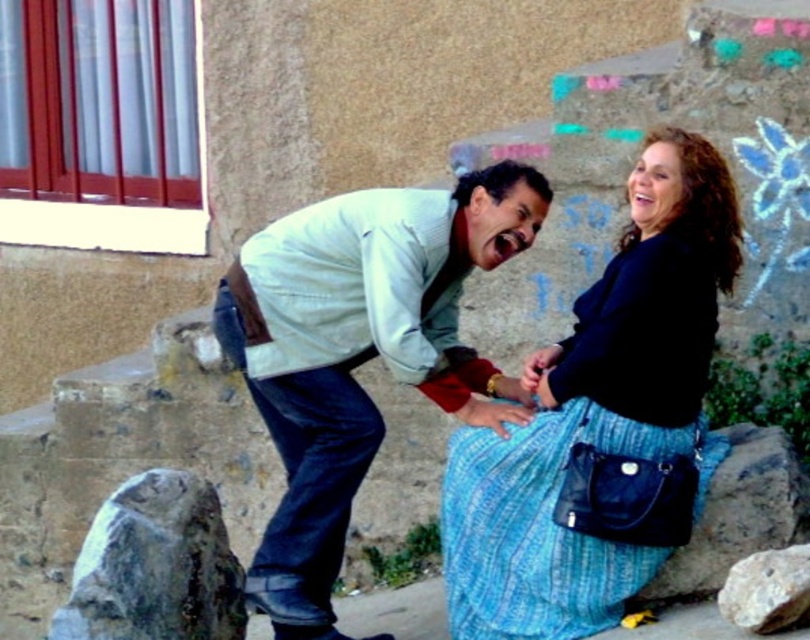
Question: Considering the relative positions of gray rough rock at lower left and smooth gray rock at lower right in the image provided, where is gray rough rock at lower left located with respect to smooth gray rock at lower right?

Choices:
 (A) right
 (B) left

Answer: (B)

Question: Which object appears closest to the camera in this image?

Choices:
 (A) light blue denim jeans at center
 (B) gray rough rock at lower right

Answer: (B)

Question: Is gray rough rock at lower left below gray rough rock at lower right?

Choices:
 (A) yes
 (B) no

Answer: (A)

Question: Which of these objects is positioned closest to the gray rough rock at lower right?

Choices:
 (A) blue textured skirt at center
 (B) gray rough rock at lower left

Answer: (A)

Question: From the image, what is the correct spatial relationship of gray rough rock at lower left in relation to gray rough rock at lower right?

Choices:
 (A) right
 (B) left

Answer: (B)

Question: Which of these objects is positioned farthest from the smooth gray rock at lower right?

Choices:
 (A) light blue denim jeans at center
 (B) gray rough rock at lower right

Answer: (A)